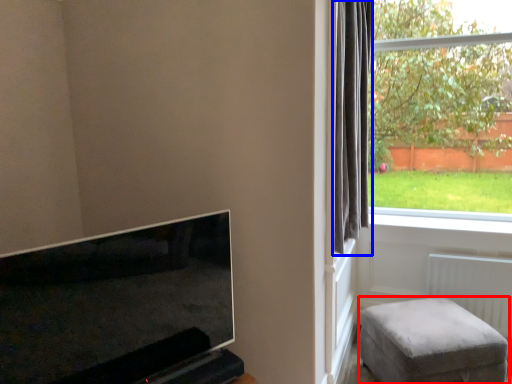
Question: Which object appears farthest to the camera in this image, furniture (highlighted by a red box) or curtain (highlighted by a blue box)?

Choices:
 (A) furniture
 (B) curtain

Answer: (A)